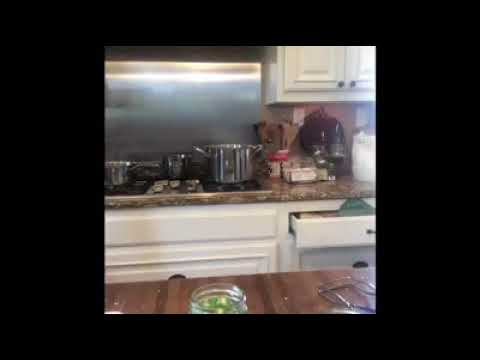
In order to click on handle in this screenshot , I will do `click(353, 81)`.